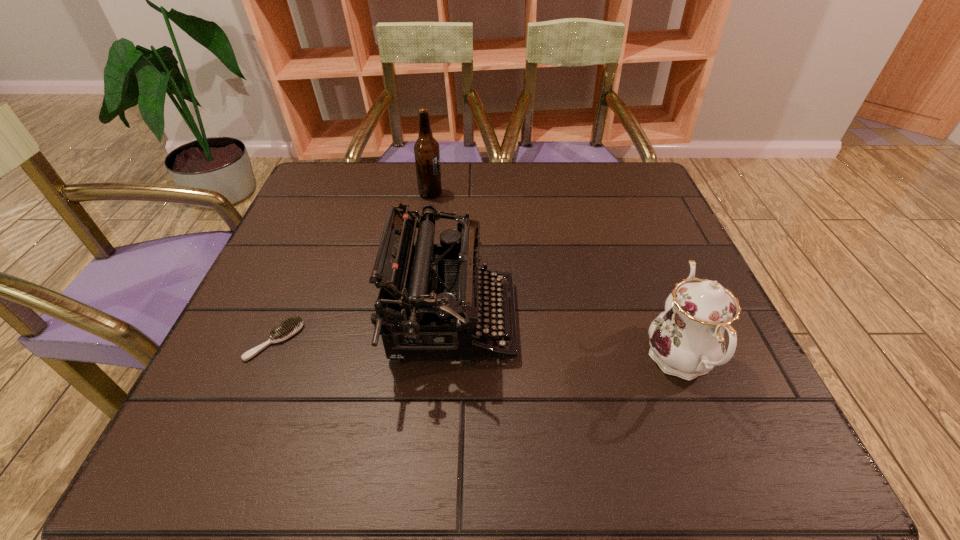
Locate an element on the screen. vacant point located between the leftmost object and the farthest object is located at coordinates (353, 267).

Where is `vacant region between the typewriter and the rightmost object`? The image size is (960, 540). vacant region between the typewriter and the rightmost object is located at coordinates (565, 340).

Locate an element on the screen. free area in between the typewriter and the rightmost object is located at coordinates (565, 340).

Image resolution: width=960 pixels, height=540 pixels. Find the location of `object that can be found as the second closest to the scrubbing brush`. object that can be found as the second closest to the scrubbing brush is located at coordinates (426, 149).

Identify the location of object that can be found as the second closest to the chinaware. This screenshot has width=960, height=540. (426, 149).

The width and height of the screenshot is (960, 540). In order to click on free location that satisfies the following two spatial constraints: 1. on the front side of the scrubbing brush; 2. on the right side of the chinaware in this screenshot , I will do `click(267, 359)`.

What are the coordinates of `vacant space that satisfies the following two spatial constraints: 1. on the back side of the chinaware; 2. on the keyboard of the typewriter` in the screenshot? It's located at (664, 320).

At what (x,y) coordinates should I click in order to perform the action: click on vacant position in the image that satisfies the following two spatial constraints: 1. on the keyboard of the chinaware; 2. on the right side of the typewriter. Please return your answer as a coordinate pair (x, y). Looking at the image, I should click on (449, 359).

I want to click on vacant space that satisfies the following two spatial constraints: 1. on the keyboard of the typewriter; 2. on the back side of the chinaware, so pos(449,359).

Locate an element on the screen. Image resolution: width=960 pixels, height=540 pixels. free location that satisfies the following two spatial constraints: 1. on the front side of the rightmost object; 2. on the right side of the leftmost object is located at coordinates (267, 359).